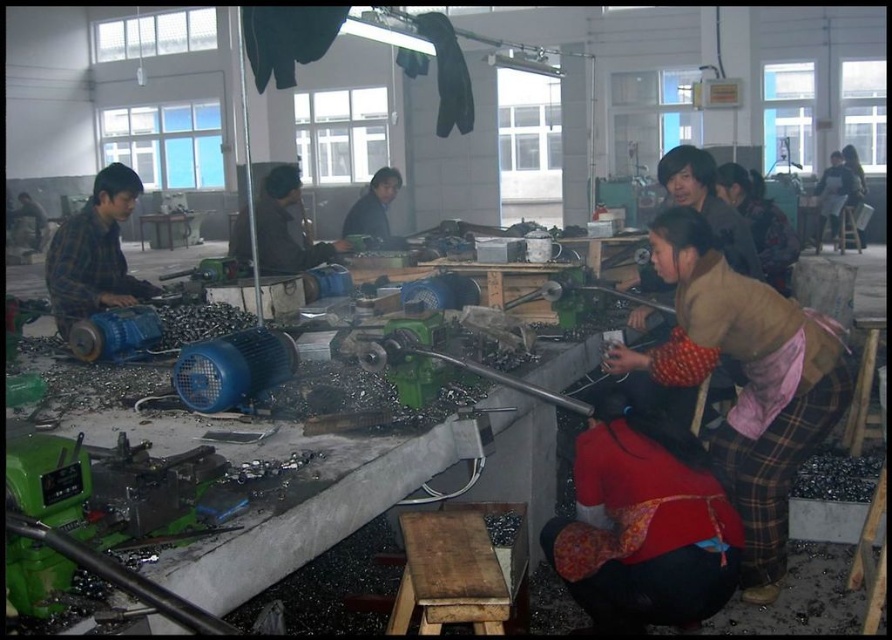
Does red fabric skirt at lower center have a greater width compared to matte black shirt at center?

Yes.

Does point (566, 572) come farther from viewer compared to point (383, 216)?

No, it is in front of (383, 216).

What do you see at coordinates (643, 524) in the screenshot? I see `red fabric skirt at lower center` at bounding box center [643, 524].

The width and height of the screenshot is (892, 640). I want to click on red fabric skirt at lower center, so click(643, 524).

Between point (62, 264) and point (370, 184), which one is positioned behind?

The point (370, 184) is more distant.

Does plaid fabric shirt at left have a lesser width compared to matte black shirt at center?

No, plaid fabric shirt at left is not thinner than matte black shirt at center.

What do you see at coordinates (95, 252) in the screenshot? I see `plaid fabric shirt at left` at bounding box center [95, 252].

Where is `plaid fabric shirt at left`? The height and width of the screenshot is (640, 892). plaid fabric shirt at left is located at coordinates (95, 252).

Image resolution: width=892 pixels, height=640 pixels. What do you see at coordinates (374, 209) in the screenshot?
I see `matte black shirt at center` at bounding box center [374, 209].

Does matte black shirt at center appear on the left side of metallic gray tool at center?

Correct, you'll find matte black shirt at center to the left of metallic gray tool at center.

Which is in front, point (383, 193) or point (245, 440)?

Point (245, 440) is in front.

Where is `matte black shirt at center`? matte black shirt at center is located at coordinates (374, 209).